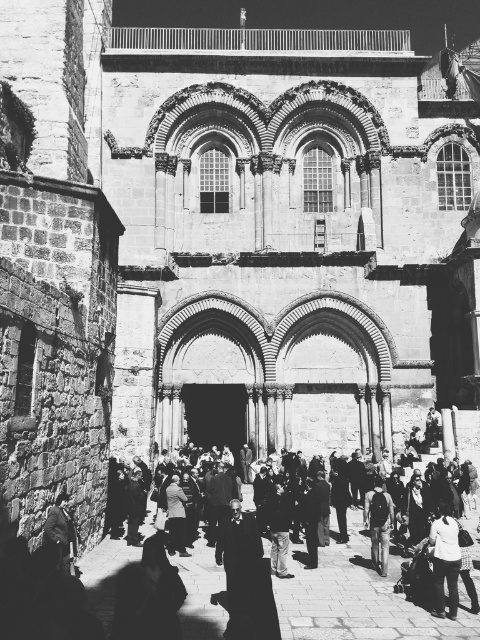
Is dark gray backpack at center closer to the viewer compared to dark wool coat at lower left?

No, it is behind dark wool coat at lower left.

Looking at this image, can you confirm if dark gray backpack at center is wider than dark wool coat at lower left?

Correct, the width of dark gray backpack at center exceeds that of dark wool coat at lower left.

Measure the distance between point [372,522] and camera.

Point [372,522] and camera are 47.98 meters apart.

Image resolution: width=480 pixels, height=640 pixels. Identify the location of dark gray backpack at center. (379, 524).

Can you confirm if white cotton shirt at lower right is positioned above dark gray backpack at center?

Yes.

Does point (450, 522) come farther from viewer compared to point (372, 516)?

No, it is in front of (372, 516).

Identify the location of white cotton shirt at lower right. (444, 561).

Can you confirm if white cotton shirt at lower right is shorter than dark wool coat at lower left?

In fact, white cotton shirt at lower right may be taller than dark wool coat at lower left.

Between white cotton shirt at lower right and dark wool coat at lower left, which one appears on the right side from the viewer's perspective?

white cotton shirt at lower right

You are a GUI agent. You are given a task and a screenshot of the screen. Output one action in this format:
    pyautogui.click(x=<x>, y=<y>)
    Task: Click on the white cotton shirt at lower right
    This screenshot has width=480, height=640.
    Given the screenshot: What is the action you would take?
    pyautogui.click(x=444, y=561)

Where is `white cotton shirt at lower right`? white cotton shirt at lower right is located at coordinates point(444,561).